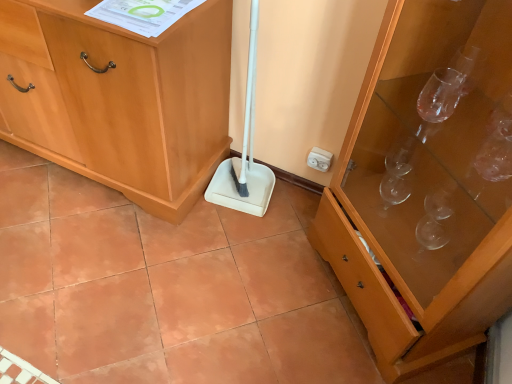
Question: Is light wood cabinet at center, placed as the first cabinetry when sorted from left to right, outside transparent glass cabinet at right, which ranks as the second cabinetry in left-to-right order?

Choices:
 (A) no
 (B) yes

Answer: (B)

Question: Considering the relative sizes of light wood cabinet at center, placed as the first cabinetry when sorted from left to right, and transparent glass cabinet at right, acting as the first cabinetry starting from the right, in the image provided, is light wood cabinet at center, placed as the first cabinetry when sorted from left to right, bigger than transparent glass cabinet at right, acting as the first cabinetry starting from the right,?

Choices:
 (A) yes
 (B) no

Answer: (A)

Question: Does light wood cabinet at center, placed as the first cabinetry when sorted from left to right, contain transparent glass cabinet at right, which ranks as the second cabinetry in left-to-right order?

Choices:
 (A) no
 (B) yes

Answer: (A)

Question: Is light wood cabinet at center, placed as the 2th cabinetry when sorted from right to left, taller than transparent glass cabinet at right, acting as the first cabinetry starting from the right?

Choices:
 (A) no
 (B) yes

Answer: (A)

Question: Does light wood cabinet at center, placed as the first cabinetry when sorted from left to right, have a lesser height compared to transparent glass cabinet at right, acting as the first cabinetry starting from the right?

Choices:
 (A) yes
 (B) no

Answer: (A)

Question: Is white plastic electric outlet at upper right inside or outside of light wood cabinet at center, placed as the first cabinetry when sorted from left to right?

Choices:
 (A) inside
 (B) outside

Answer: (B)

Question: Is white plastic electric outlet at upper right bigger or smaller than light wood cabinet at center, placed as the first cabinetry when sorted from left to right?

Choices:
 (A) small
 (B) big

Answer: (A)

Question: From a real-world perspective, is white plastic electric outlet at upper right above or below light wood cabinet at center, placed as the first cabinetry when sorted from left to right?

Choices:
 (A) above
 (B) below

Answer: (B)

Question: Is white plastic electric outlet at upper right wider or thinner than light wood cabinet at center, placed as the 2th cabinetry when sorted from right to left?

Choices:
 (A) thin
 (B) wide

Answer: (A)

Question: Considering their positions, is light wood cabinet at center, placed as the 2th cabinetry when sorted from right to left, located in front of or behind white plastic electric outlet at upper right?

Choices:
 (A) behind
 (B) front

Answer: (B)

Question: Looking at the image, does light wood cabinet at center, placed as the 2th cabinetry when sorted from right to left, seem bigger or smaller compared to white plastic electric outlet at upper right?

Choices:
 (A) small
 (B) big

Answer: (B)

Question: Does point (179, 188) appear closer or farther from the camera than point (312, 158)?

Choices:
 (A) farther
 (B) closer

Answer: (B)

Question: From the image's perspective, is light wood cabinet at center, placed as the first cabinetry when sorted from left to right, positioned above or below white plastic electric outlet at upper right?

Choices:
 (A) above
 (B) below

Answer: (A)

Question: From a real-world perspective, is white plastic electric outlet at upper right positioned above or below white plastic shovel at center?

Choices:
 (A) above
 (B) below

Answer: (B)

Question: Considering the positions of point pyautogui.click(x=326, y=167) and point pyautogui.click(x=265, y=167), is point pyautogui.click(x=326, y=167) closer or farther from the camera than point pyautogui.click(x=265, y=167)?

Choices:
 (A) closer
 (B) farther

Answer: (A)